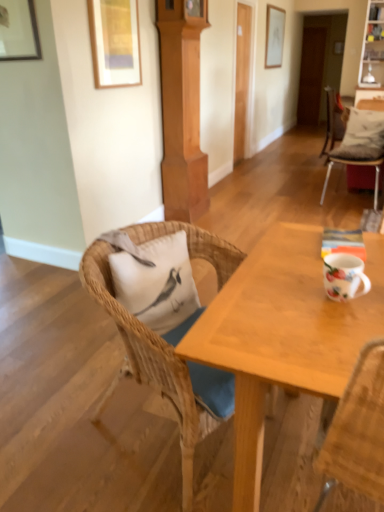
Question: Choose the correct answer: Is white fabric pillow at upper right, positioned as the 1th pillow in top-to-bottom order, inside white glossy mug at right or outside it?

Choices:
 (A) inside
 (B) outside

Answer: (B)

Question: Does point (354, 158) appear closer or farther from the camera than point (359, 271)?

Choices:
 (A) farther
 (B) closer

Answer: (A)

Question: Which object is the closest to the white glossy mug at right?

Choices:
 (A) white cushioned chair at right, which is counted as the 2th chair, starting from the bottom
 (B) white matte pillow at left, arranged as the second pillow when viewed from the right
 (C) white fabric pillow at upper right, which is counted as the first pillow, starting from the right
 (D) matte white picture frame at upper center, the 1th picture frame in the top-to-bottom sequence
 (E) woven wood chair at center, which is the 1th chair in left-to-right order

Answer: (E)

Question: Which is farther from the matte white picture frame at upper center, the third picture frame when ordered from bottom to top?

Choices:
 (A) white cushioned chair at right, the first chair positioned from the back
 (B) matte wooden picture frame at upper left, acting as the second picture frame starting from the bottom
 (C) wooden picture frame at upper left, the 3th picture frame in the right-to-left sequence
 (D) woven wood chair at center, the 1th chair when ordered from bottom to top
 (E) white matte pillow at left, the first pillow positioned from the left

Answer: (D)